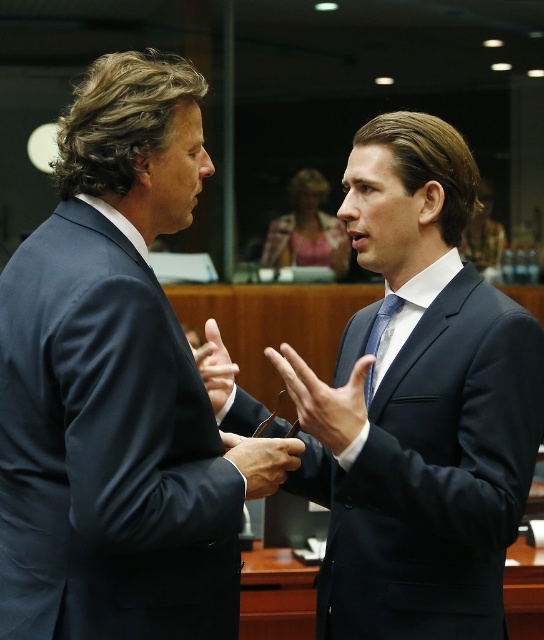
Question: Which object is the closest to the smooth black suit at center?

Choices:
 (A) matte blue tie at center
 (B) black leather hand at center
 (C) matte black suit at left
 (D) dark blue suit at center

Answer: (A)

Question: From the image, what is the correct spatial relationship of dark blue suit at center in relation to black leather hand at center?

Choices:
 (A) above
 (B) below

Answer: (A)

Question: Does matte black suit at left appear over smooth black suit at center?

Choices:
 (A) yes
 (B) no

Answer: (A)

Question: Observing the image, what is the correct spatial positioning of smooth black suit at center in reference to matte black hand at center?

Choices:
 (A) left
 (B) right

Answer: (B)

Question: Among these objects, which one is nearest to the camera?

Choices:
 (A) smooth black suit at center
 (B) matte black suit at left
 (C) black leather hand at center
 (D) matte blue tie at center

Answer: (B)

Question: Which object is positioned closest to the matte blue tie at center?

Choices:
 (A) matte black hand at center
 (B) black leather hand at center

Answer: (A)